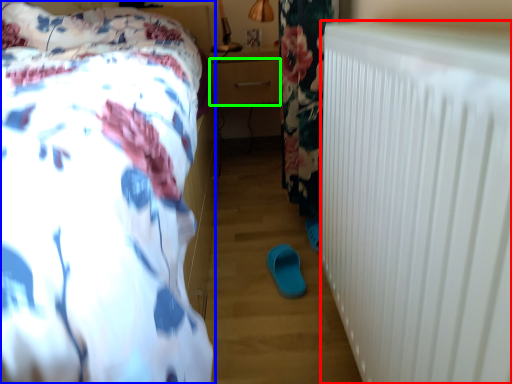
Question: Which is farther away from radiator (highlighted by a red box)? bed (highlighted by a blue box) or drawer (highlighted by a green box)?

Choices:
 (A) bed
 (B) drawer

Answer: (B)